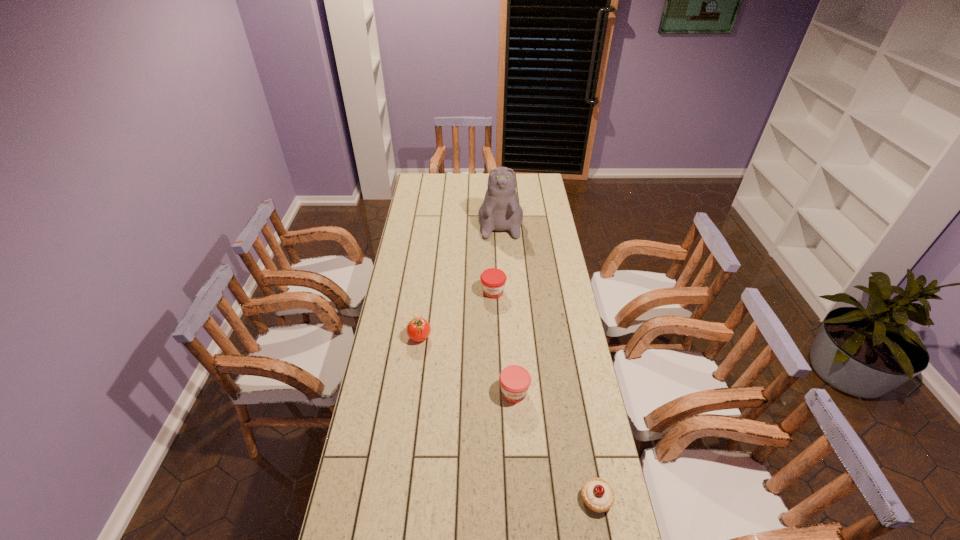
Locate which object is the closest to the nearer jam. Please provide its 2D coordinates. Your answer should be formatted as a tuple, i.e. [(x, y)], where the tuple contains the x and y coordinates of a point satisfying the conditions above.

[(597, 494)]

At what (x,y) coordinates should I click in order to perform the action: click on vacant position in the image that satisfies the following two spatial constraints: 1. on the front label of the shortest object; 2. on the right side of the nearer jam. Please return your answer as a coordinate pair (x, y). The height and width of the screenshot is (540, 960). Looking at the image, I should click on (521, 498).

The image size is (960, 540). Find the location of `blank space that satisfies the following two spatial constraints: 1. on the front label of the second nearest object; 2. on the left side of the shortest object`. blank space that satisfies the following two spatial constraints: 1. on the front label of the second nearest object; 2. on the left side of the shortest object is located at coordinates (521, 498).

At what (x,y) coordinates should I click in order to perform the action: click on free location that satisfies the following two spatial constraints: 1. on the face of the pastry; 2. on the left side of the cat. Please return your answer as a coordinate pair (x, y). Looking at the image, I should click on (516, 498).

What are the coordinates of `blank space that satisfies the following two spatial constraints: 1. on the front label of the rightmost object; 2. on the left side of the nearer jam` in the screenshot? It's located at (521, 498).